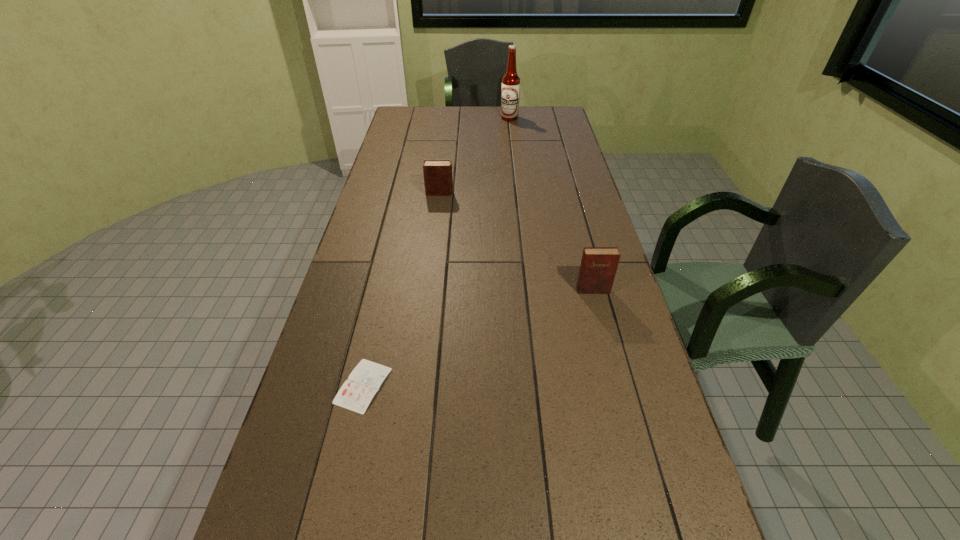
This screenshot has width=960, height=540. I want to click on the farthest object, so click(510, 93).

The height and width of the screenshot is (540, 960). In order to click on the second object from right to left in this screenshot , I will do `click(510, 93)`.

Find the location of a particular element. The width and height of the screenshot is (960, 540). the rightmost diary is located at coordinates (598, 267).

This screenshot has width=960, height=540. I want to click on the third farthest object, so click(x=598, y=267).

The width and height of the screenshot is (960, 540). I want to click on the third nearest object, so click(x=438, y=181).

Find the location of `the farthest diary`. the farthest diary is located at coordinates (438, 181).

Where is `the leftmost diary`? The height and width of the screenshot is (540, 960). the leftmost diary is located at coordinates click(x=356, y=393).

This screenshot has width=960, height=540. In order to click on the shortest object in this screenshot , I will do `click(356, 393)`.

Find the location of a particular element. This screenshot has width=960, height=540. free space located 0.400m on the label side of the second object from right to left is located at coordinates (515, 161).

Locate an element on the screen. This screenshot has height=540, width=960. vacant point located on the front cover of the third farthest object is located at coordinates (602, 325).